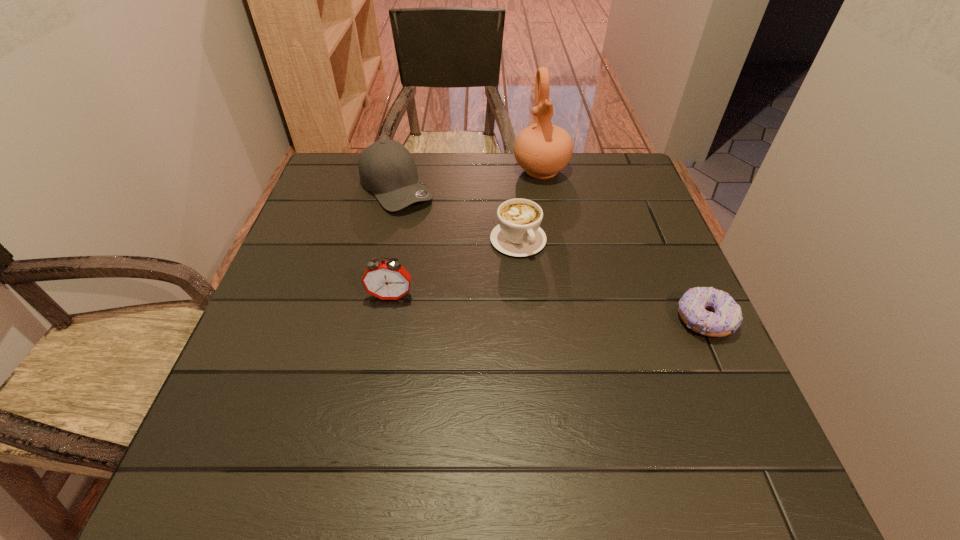
Locate an element on the screen. vacant space that is in between the cappuccino and the baseball cap is located at coordinates (457, 214).

I want to click on vacant area that lies between the shortest object and the baseball cap, so click(x=551, y=254).

Locate an element on the screen. free space between the tallest object and the baseball cap is located at coordinates (468, 179).

Image resolution: width=960 pixels, height=540 pixels. I want to click on unoccupied area between the rightmost object and the second shortest object, so (612, 280).

This screenshot has height=540, width=960. I want to click on free point between the baseball cap and the tallest object, so click(468, 179).

Where is `free space that is in between the baseball cap and the fourth tallest object`? Image resolution: width=960 pixels, height=540 pixels. free space that is in between the baseball cap and the fourth tallest object is located at coordinates (457, 214).

What are the coordinates of `the closest object to the pottery` in the screenshot? It's located at (518, 233).

Find the location of a particular element. object that is the third closest to the baseball cap is located at coordinates (387, 280).

The width and height of the screenshot is (960, 540). I want to click on free space that satisfies the following two spatial constraints: 1. on the clock face of the alarm clock; 2. on the left side of the doughnut, so click(387, 319).

Identify the location of vacant region that satisfies the following two spatial constraints: 1. on the front side of the baseball cap; 2. on the left side of the doughnut. (367, 319).